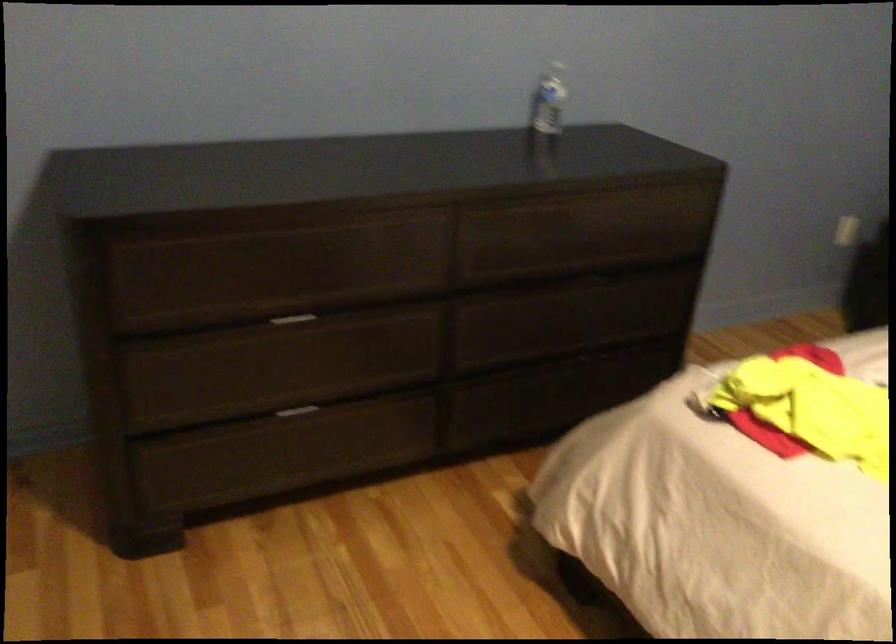
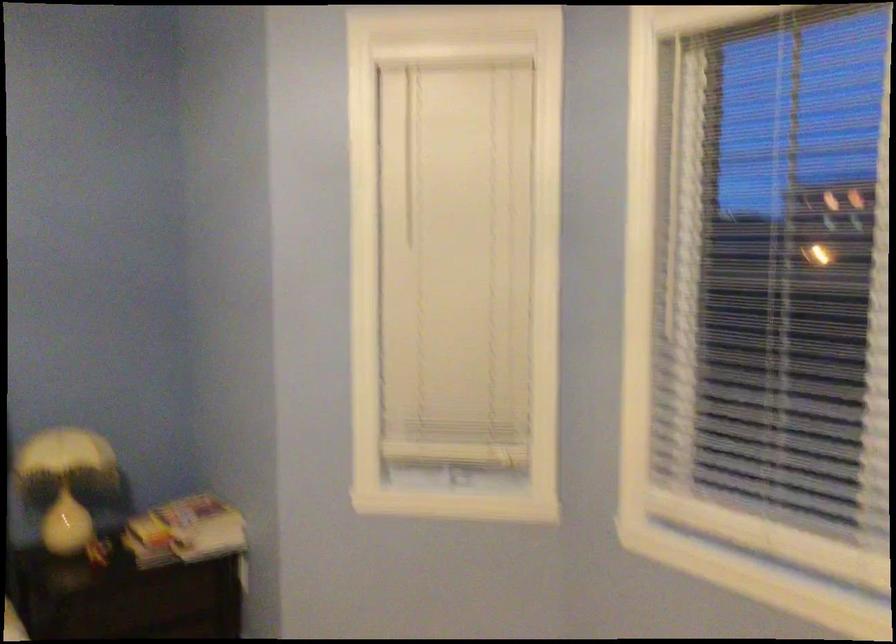
Question: How did the camera likely rotate?

Choices:
 (A) Left
 (B) Right
 (C) Up
 (D) Down

Answer: (B)